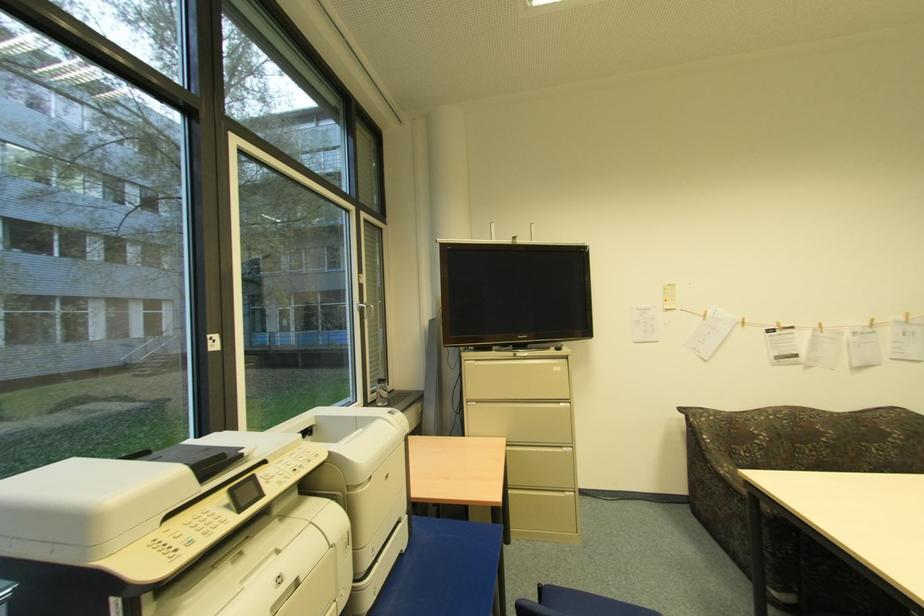
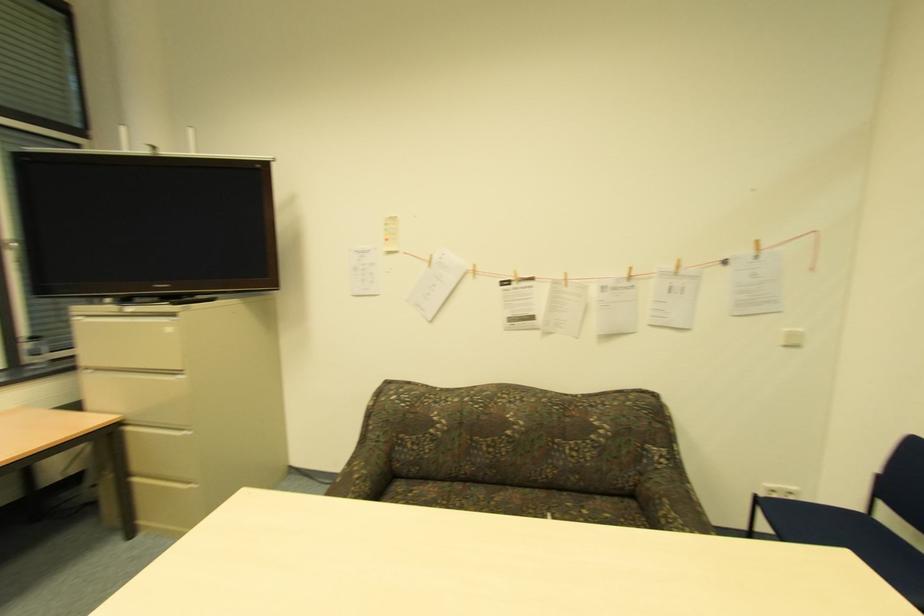
Find the pixel in the second image that matches pixel 706 318 in the first image.

(428, 265)